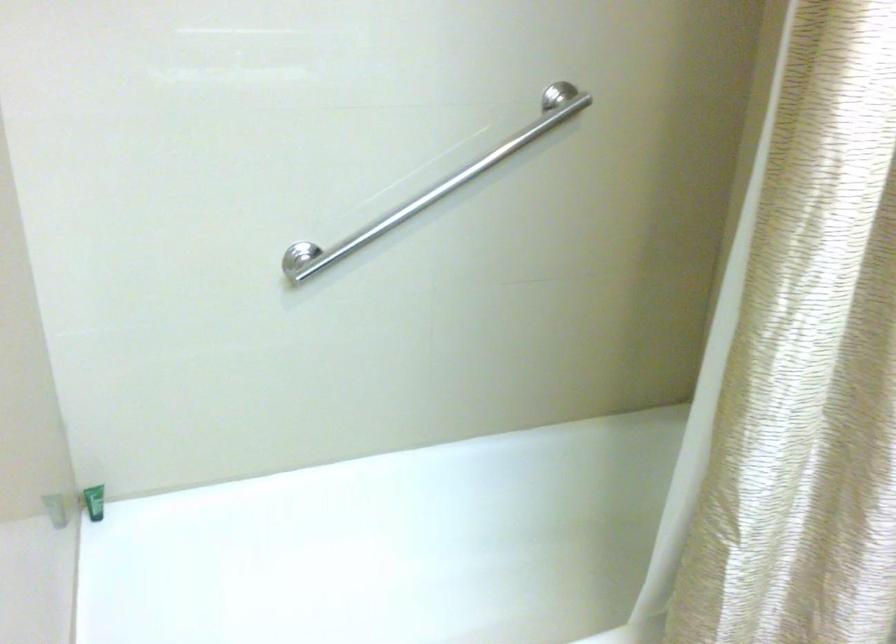
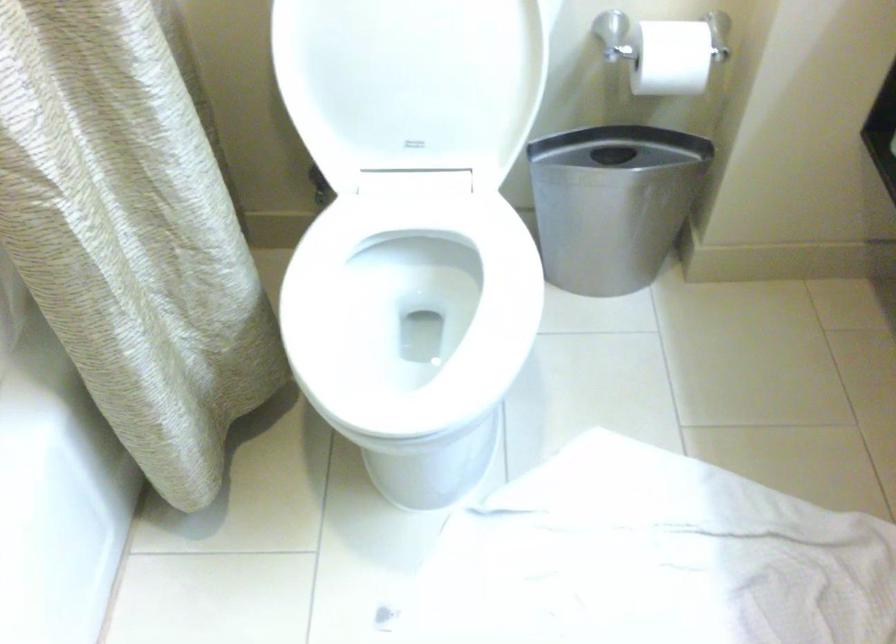
How did the camera likely rotate?

The camera rotated toward right-down.